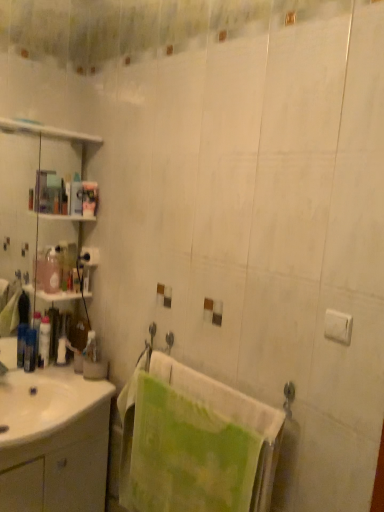
Question: Can you confirm if white matte toilet paper at upper left is positioned to the left of white glossy lotion at left, which is the 4th toiletry in right-to-left order?

Choices:
 (A) yes
 (B) no

Answer: (B)

Question: Is white matte toilet paper at upper left not near white glossy lotion at left, marked as the 2th toiletry in a left-to-right arrangement?

Choices:
 (A) no
 (B) yes

Answer: (A)

Question: Considering the relative positions of white matte toilet paper at upper left and white glossy lotion at left, marked as the 2th toiletry in a left-to-right arrangement, in the image provided, is white matte toilet paper at upper left to the right of white glossy lotion at left, marked as the 2th toiletry in a left-to-right arrangement, from the viewer's perspective?

Choices:
 (A) no
 (B) yes

Answer: (B)

Question: Is white matte toilet paper at upper left beside white glossy lotion at left, which is the 4th toiletry in right-to-left order?

Choices:
 (A) yes
 (B) no

Answer: (B)

Question: Is white matte toilet paper at upper left positioned with its back to white glossy lotion at left, which is the 4th toiletry in right-to-left order?

Choices:
 (A) yes
 (B) no

Answer: (B)

Question: From the image's perspective, is green textured towel at center positioned above or below pink glossy bottle at left, placed as the third toiletry when sorted from right to left?

Choices:
 (A) above
 (B) below

Answer: (B)

Question: Which is correct: green textured towel at center is inside pink glossy bottle at left, marked as the 3th toiletry in a left-to-right arrangement, or outside of it?

Choices:
 (A) inside
 (B) outside

Answer: (B)

Question: Considering the positions of point (182, 500) and point (48, 270), is point (182, 500) closer or farther from the camera than point (48, 270)?

Choices:
 (A) closer
 (B) farther

Answer: (A)

Question: Considering the positions of green textured towel at center and pink glossy bottle at left, placed as the third toiletry when sorted from right to left, in the image, is green textured towel at center taller or shorter than pink glossy bottle at left, placed as the third toiletry when sorted from right to left,?

Choices:
 (A) tall
 (B) short

Answer: (A)

Question: Considering their positions, is translucent plastic bottle at left, the 1th toiletry from the left, located in front of or behind white glossy cabinet at lower left?

Choices:
 (A) behind
 (B) front

Answer: (A)

Question: In terms of width, does translucent plastic bottle at left, the 5th toiletry positioned from the right, look wider or thinner when compared to white glossy cabinet at lower left?

Choices:
 (A) thin
 (B) wide

Answer: (A)

Question: From the image's perspective, is translucent plastic bottle at left, the 1th toiletry from the left, positioned above or below white glossy cabinet at lower left?

Choices:
 (A) below
 (B) above

Answer: (B)

Question: Is translucent plastic bottle at left, the 5th toiletry positioned from the right, spatially inside white glossy cabinet at lower left, or outside of it?

Choices:
 (A) inside
 (B) outside

Answer: (B)

Question: Is pink glossy bottle at left, marked as the 3th toiletry in a left-to-right arrangement, situated inside white matte toilet paper at upper left or outside?

Choices:
 (A) outside
 (B) inside

Answer: (A)

Question: In terms of height, does pink glossy bottle at left, marked as the 3th toiletry in a left-to-right arrangement, look taller or shorter compared to white matte toilet paper at upper left?

Choices:
 (A) short
 (B) tall

Answer: (B)